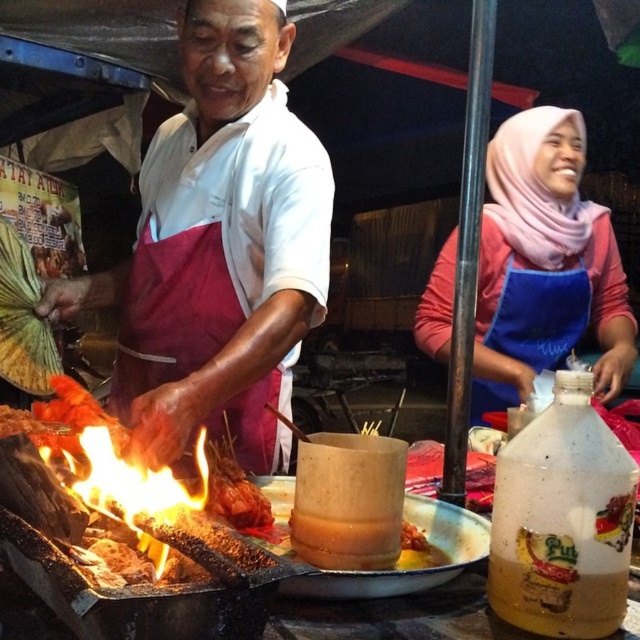
Can you confirm if white matte apron at center is positioned above pink fabric hijab at upper right?

No.

Can you confirm if white matte apron at center is positioned to the right of pink fabric hijab at upper right?

In fact, white matte apron at center is to the left of pink fabric hijab at upper right.

Who is more forward, (211, 413) or (588, 282)?

Point (211, 413)

The image size is (640, 640). I want to click on white matte apron at center, so click(218, 248).

Which is in front, point (250, 237) or point (513, 467)?

Point (513, 467) is more forward.

Is white matte apron at center further to camera compared to translucent plastic bottle at center-right?

Yes, it is.

At what (x,y) coordinates should I click in order to perform the action: click on white matte apron at center. Please return your answer as a coordinate pair (x, y). The height and width of the screenshot is (640, 640). Looking at the image, I should click on (218, 248).

Image resolution: width=640 pixels, height=640 pixels. I want to click on white matte apron at center, so click(218, 248).

Does pink fabric hijab at upper right appear over translucent plastic bottle at center-right?

Yes, pink fabric hijab at upper right is above translucent plastic bottle at center-right.

Measure the distance between pink fabric hijab at upper right and camera.

pink fabric hijab at upper right is 1.55 meters away from camera.

What are the coordinates of `pink fabric hijab at upper right` in the screenshot? It's located at (545, 266).